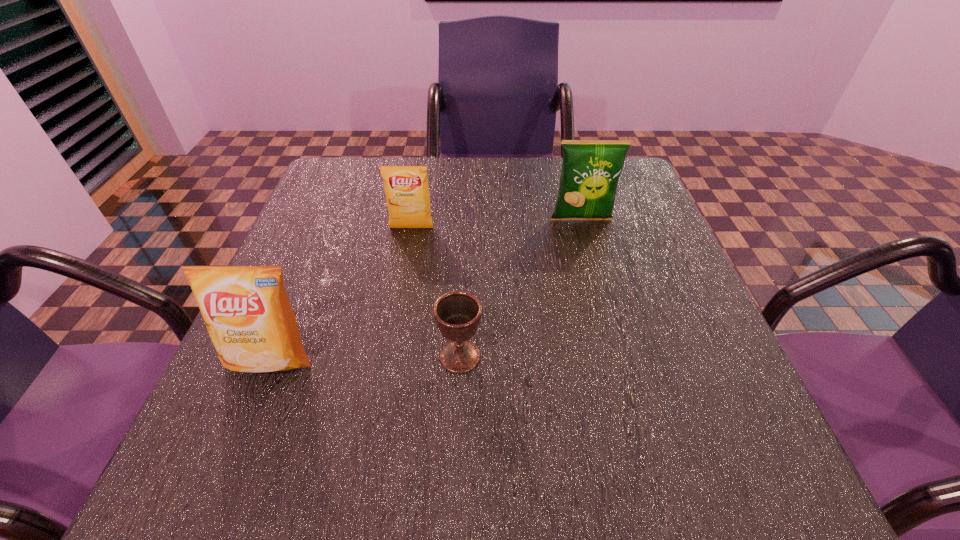
Where is `vacant position located on the left of the second object from right to left`? This screenshot has width=960, height=540. vacant position located on the left of the second object from right to left is located at coordinates (293, 356).

Find the location of a particular element. The image size is (960, 540). object present at the left edge is located at coordinates (246, 310).

Image resolution: width=960 pixels, height=540 pixels. Find the location of `object situated at the right edge`. object situated at the right edge is located at coordinates (590, 171).

Locate an element on the screen. vacant space at the far edge of the desktop is located at coordinates (515, 179).

Locate an element on the screen. vacant area at the near edge is located at coordinates (508, 437).

Identify the location of vacant space at the left edge of the desktop. (341, 207).

Where is `blank area at the right edge`? Image resolution: width=960 pixels, height=540 pixels. blank area at the right edge is located at coordinates (625, 300).

This screenshot has width=960, height=540. Find the location of `vacant region at the far left corner of the desktop`. vacant region at the far left corner of the desktop is located at coordinates (374, 179).

In the image, there is a desktop. In order to click on vacant space at the near left corner in this screenshot , I will do `click(279, 440)`.

Where is `unoccupied position between the leftmost crisp (potato chip) and the rightmost object`? The width and height of the screenshot is (960, 540). unoccupied position between the leftmost crisp (potato chip) and the rightmost object is located at coordinates (426, 290).